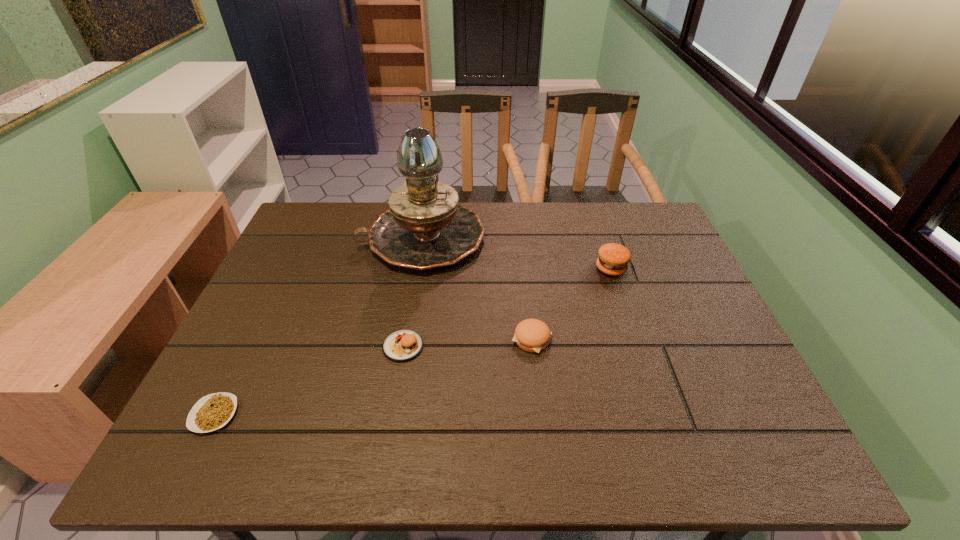
You are a GUI agent. You are given a task and a screenshot of the screen. Output one action in this format:
    pyautogui.click(x=<x>, y=<y>)
    Task: Click on the tallest object
    The height and width of the screenshot is (540, 960).
    Given the screenshot: What is the action you would take?
    pyautogui.click(x=425, y=228)

You are a GUI agent. You are given a task and a screenshot of the screen. Output one action in this format:
    pyautogui.click(x=<x>, y=<y>)
    Task: Click on the rightmost object
    
    Given the screenshot: What is the action you would take?
    pyautogui.click(x=613, y=259)

Where is `the farthest patty`? The height and width of the screenshot is (540, 960). the farthest patty is located at coordinates (613, 259).

Locate an element on the screen. This screenshot has width=960, height=540. the leftmost patty is located at coordinates (402, 345).

This screenshot has width=960, height=540. Identify the location of the second object from right to left. (532, 335).

You are a GUI agent. You are given a task and a screenshot of the screen. Output one action in this format:
    pyautogui.click(x=<x>, y=<y>)
    Task: Click on the second patty from left to right
    The image size is (960, 540).
    Given the screenshot: What is the action you would take?
    pyautogui.click(x=532, y=335)

You are a GUI agent. You are given a task and a screenshot of the screen. Output one action in this format:
    pyautogui.click(x=<x>, y=<y>)
    Task: Click on the shortest object
    The image size is (960, 540).
    Given the screenshot: What is the action you would take?
    pyautogui.click(x=213, y=411)

Find the location of a particular element. Image resolution: width=960 pixels, height=540 pixels. the leftmost object is located at coordinates (213, 411).

Locate an element on the screen. free space located 0.340m on the front of the oil lamp is located at coordinates (400, 379).

Where is `vacant space located on the left of the tallest patty`? Image resolution: width=960 pixels, height=540 pixels. vacant space located on the left of the tallest patty is located at coordinates (554, 268).